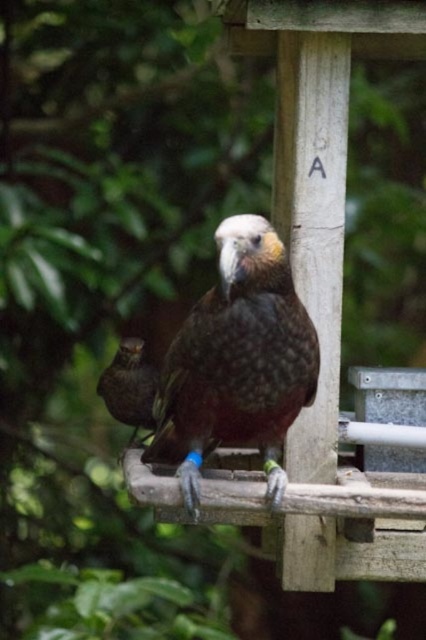
Question: Can you confirm if dark brown feathers at center is positioned to the right of brown speckled feathers at center?

Choices:
 (A) yes
 (B) no

Answer: (A)

Question: Which point appears farthest from the camera in this image?

Choices:
 (A) (235, 240)
 (B) (103, 378)

Answer: (B)

Question: Which point is farther to the camera?

Choices:
 (A) (137, 410)
 (B) (161, 451)

Answer: (A)

Question: Which of the following is the farthest from the observer?

Choices:
 (A) brown speckled feathers at center
 (B) dark brown feathers at center

Answer: (A)

Question: Can you confirm if dark brown feathers at center is smaller than brown speckled feathers at center?

Choices:
 (A) no
 (B) yes

Answer: (A)

Question: Is dark brown feathers at center positioned behind brown speckled feathers at center?

Choices:
 (A) no
 (B) yes

Answer: (A)